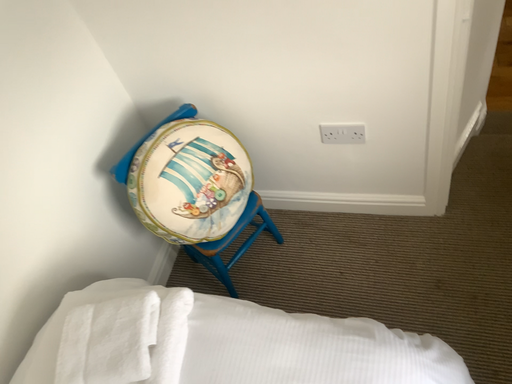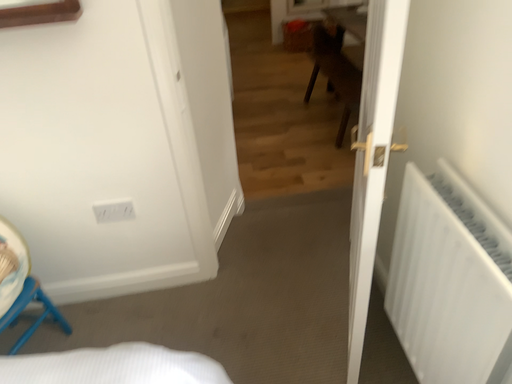
Question: How did the camera likely rotate when shooting the video?

Choices:
 (A) rotated right
 (B) rotated left

Answer: (A)